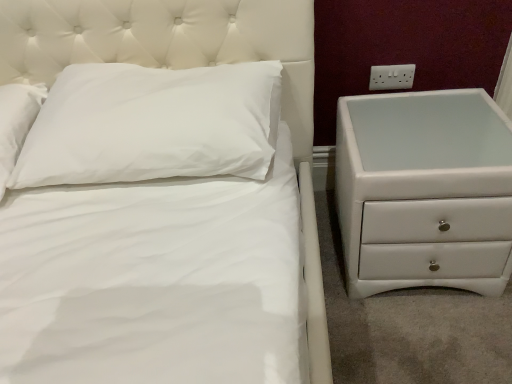
Question: Does white soft pillow at upper left appear on the right side of white plastic electrical outlet at upper right?

Choices:
 (A) no
 (B) yes

Answer: (A)

Question: Is white soft pillow at upper left shorter than white plastic electrical outlet at upper right?

Choices:
 (A) yes
 (B) no

Answer: (B)

Question: Is white soft pillow at upper left smaller than white plastic electrical outlet at upper right?

Choices:
 (A) yes
 (B) no

Answer: (B)

Question: Is white soft pillow at upper left wider than white plastic electrical outlet at upper right?

Choices:
 (A) yes
 (B) no

Answer: (A)

Question: Is the position of white soft pillow at upper left more distant than that of white plastic electrical outlet at upper right?

Choices:
 (A) no
 (B) yes

Answer: (A)

Question: From the image's perspective, is white soft pillow at upper left under white plastic electrical outlet at upper right?

Choices:
 (A) no
 (B) yes

Answer: (B)

Question: Can you confirm if white plastic electrical outlet at upper right is positioned to the right of white soft pillow at upper left?

Choices:
 (A) no
 (B) yes

Answer: (B)

Question: Does white plastic electrical outlet at upper right have a greater height compared to white soft pillow at upper left?

Choices:
 (A) no
 (B) yes

Answer: (A)

Question: Is white plastic electrical outlet at upper right positioned before white soft pillow at upper left?

Choices:
 (A) no
 (B) yes

Answer: (A)

Question: Does white plastic electrical outlet at upper right appear on the left side of white soft pillow at upper left?

Choices:
 (A) no
 (B) yes

Answer: (A)

Question: Is white plastic electrical outlet at upper right facing towards white soft pillow at upper left?

Choices:
 (A) no
 (B) yes

Answer: (A)

Question: From the image's perspective, is white plastic electrical outlet at upper right beneath white soft pillow at upper left?

Choices:
 (A) yes
 (B) no

Answer: (B)

Question: Considering the relative sizes of white glossy chest of drawers at right and white plastic electrical outlet at upper right in the image provided, is white glossy chest of drawers at right wider than white plastic electrical outlet at upper right?

Choices:
 (A) yes
 (B) no

Answer: (A)